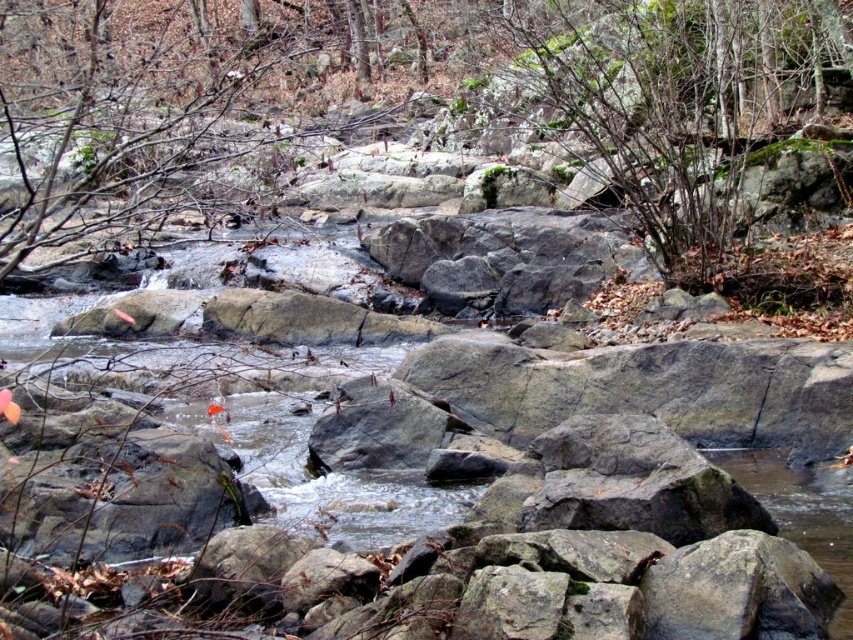
Question: Which object appears farthest from the camera in this image?

Choices:
 (A) green mossy shrub at upper center
 (B) green mossy rock at center

Answer: (A)

Question: Can you confirm if green mossy rock at center is positioned to the left of green mossy shrub at upper center?

Choices:
 (A) no
 (B) yes

Answer: (B)

Question: Does green mossy rock at center have a larger size compared to green mossy shrub at upper center?

Choices:
 (A) yes
 (B) no

Answer: (A)

Question: Among these objects, which one is nearest to the camera?

Choices:
 (A) green mossy rock at center
 (B) green mossy shrub at upper center

Answer: (A)

Question: Is green mossy rock at center bigger than green mossy shrub at upper center?

Choices:
 (A) yes
 (B) no

Answer: (A)

Question: Among these objects, which one is farthest from the camera?

Choices:
 (A) green mossy rock at center
 (B) green mossy shrub at upper center

Answer: (B)